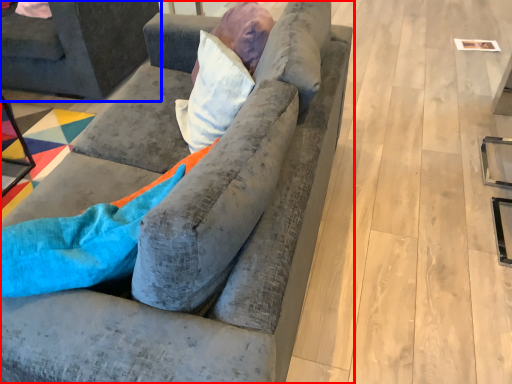
Question: Among these objects, which one is farthest to the camera, studio couch (highlighted by a red box) or studio couch (highlighted by a blue box)?

Choices:
 (A) studio couch
 (B) studio couch

Answer: (B)